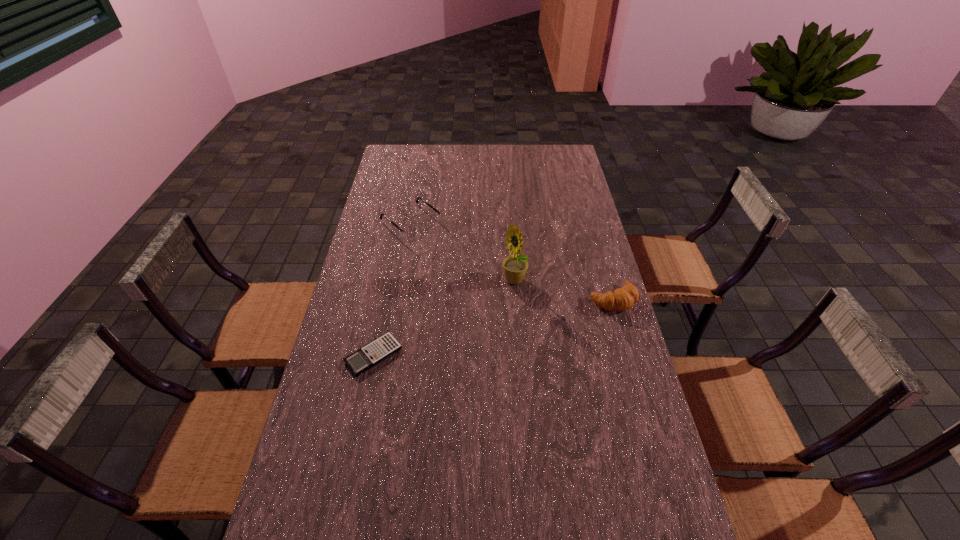
Where is `free spot at the far left corner of the desktop`? free spot at the far left corner of the desktop is located at coordinates (393, 151).

In the image, there is a desktop. Identify the location of vacant area at the far right corner. (542, 159).

Locate an element on the screen. This screenshot has height=540, width=960. free spot between the spectacles and the calculator is located at coordinates (393, 289).

Locate an element on the screen. empty location between the crescent roll and the nearest object is located at coordinates (493, 327).

Locate an element on the screen. unoccupied area between the second object from right to left and the farthest object is located at coordinates (463, 252).

The width and height of the screenshot is (960, 540). In order to click on free space between the nearest object and the rightmost object in this screenshot , I will do `click(493, 327)`.

At what (x,y) coordinates should I click in order to perform the action: click on free spot between the shortest object and the crescent roll. Please return your answer as a coordinate pair (x, y). Looking at the image, I should click on (493, 327).

Where is `free space between the calculator and the rightmost object`? This screenshot has width=960, height=540. free space between the calculator and the rightmost object is located at coordinates (493, 327).

Locate an element on the screen. Image resolution: width=960 pixels, height=540 pixels. vacant space in between the tallest object and the farthest object is located at coordinates (463, 252).

At what (x,y) coordinates should I click in order to perform the action: click on free area in between the rightmost object and the calculator. Please return your answer as a coordinate pair (x, y). The image size is (960, 540). Looking at the image, I should click on (493, 327).